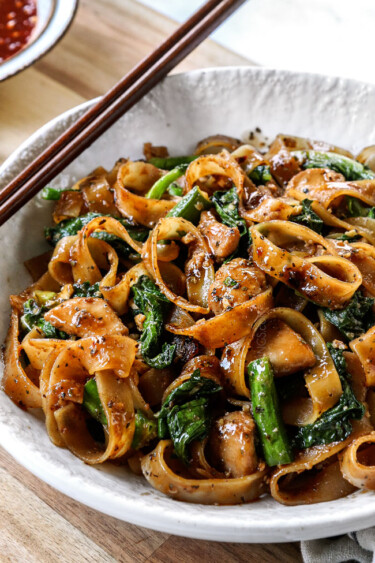
Image resolution: width=375 pixels, height=563 pixels. I want to click on white bowl with brown trim, so click(47, 39).